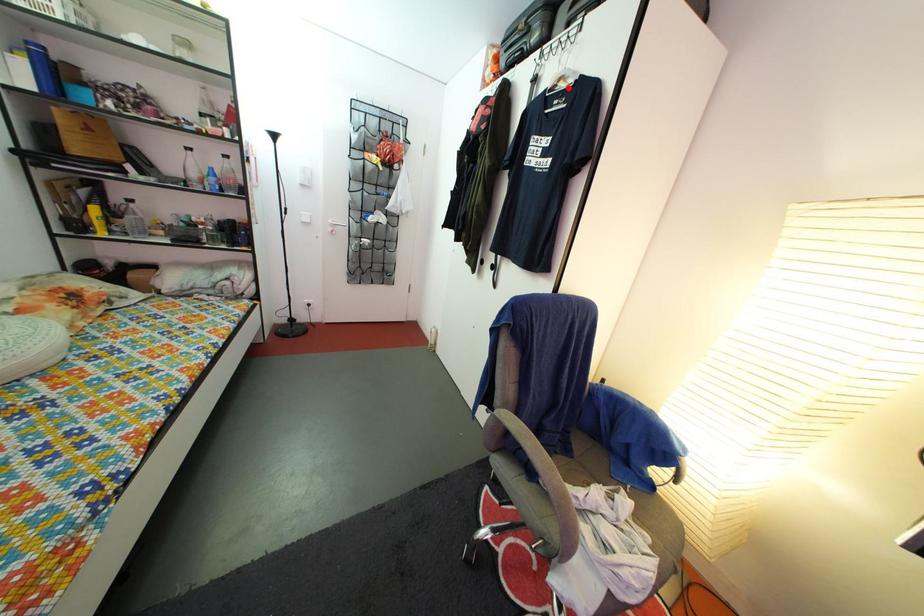
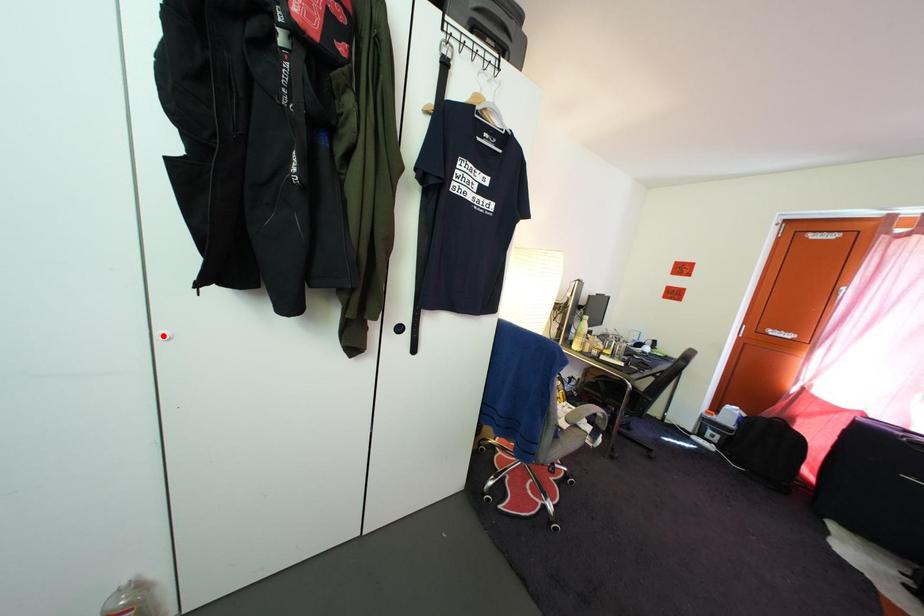
I am providing you with two images of the same scene from different viewpoints. A red point is marked on the first image and another point is marked on the second image. Does the point marked in image1 correspond to the same location as the one in image2?

No